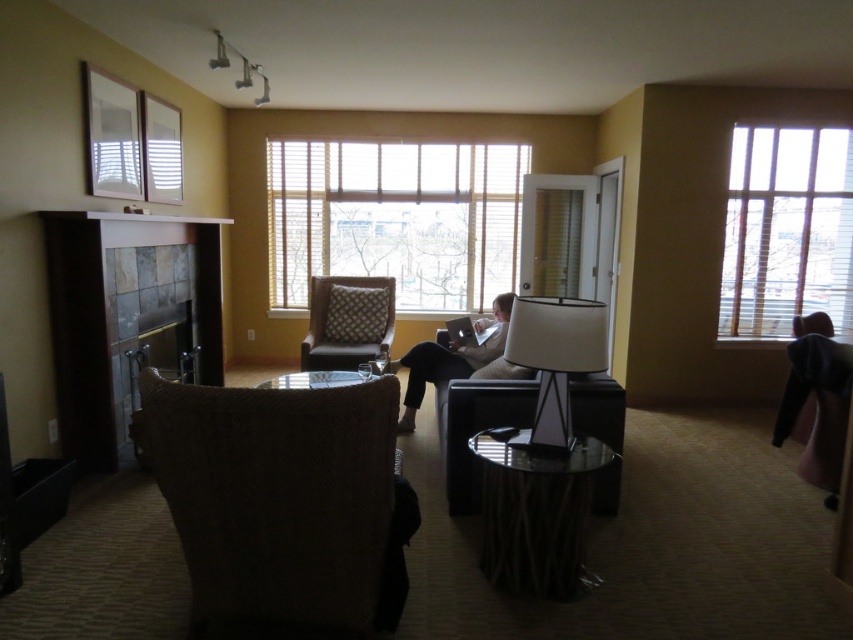
Question: Which point is farther to the camera?

Choices:
 (A) light beige fabric couch at center
 (B) wooden blinds at center

Answer: (B)

Question: Does dark brown wood fireplace at left have a greater width compared to wooden blinds at right?

Choices:
 (A) yes
 (B) no

Answer: (B)

Question: Which point is closer to the camera?

Choices:
 (A) (170, 147)
 (B) (337, 380)

Answer: (B)

Question: Estimate the real-world distances between objects in this image. Which object is closer to the matte white blinds at upper left?

Choices:
 (A) dark brown wood fireplace at left
 (B) brown textured cushioned armchair at center

Answer: (A)

Question: Is wooden blinds at right smaller than transparent glass table at center?

Choices:
 (A) yes
 (B) no

Answer: (B)

Question: Is matte white blinds at upper left to the right of brown textured cushioned armchair at center from the viewer's perspective?

Choices:
 (A) yes
 (B) no

Answer: (B)